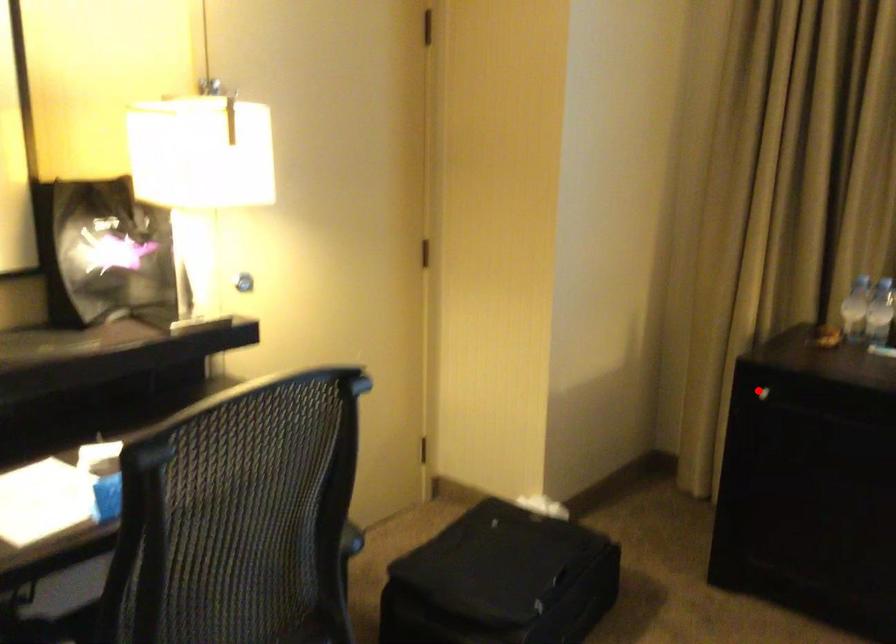
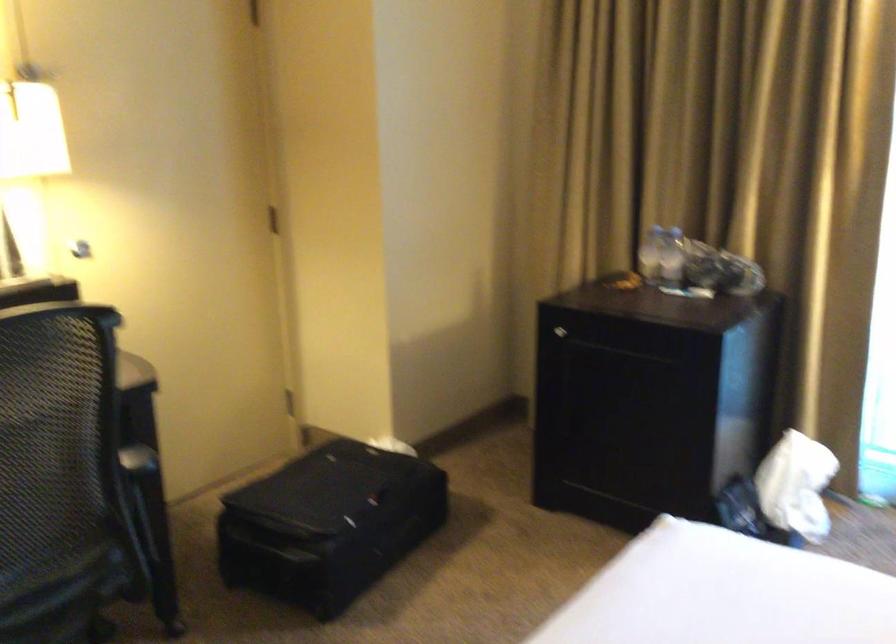
Question: I am providing you with two images of the same scene from different viewpoints. In image1, a red point is highlighted. Considering the same 3D point in image2, which of the following is correct?

Choices:
 (A) It is closer
 (B) It is farther

Answer: (B)